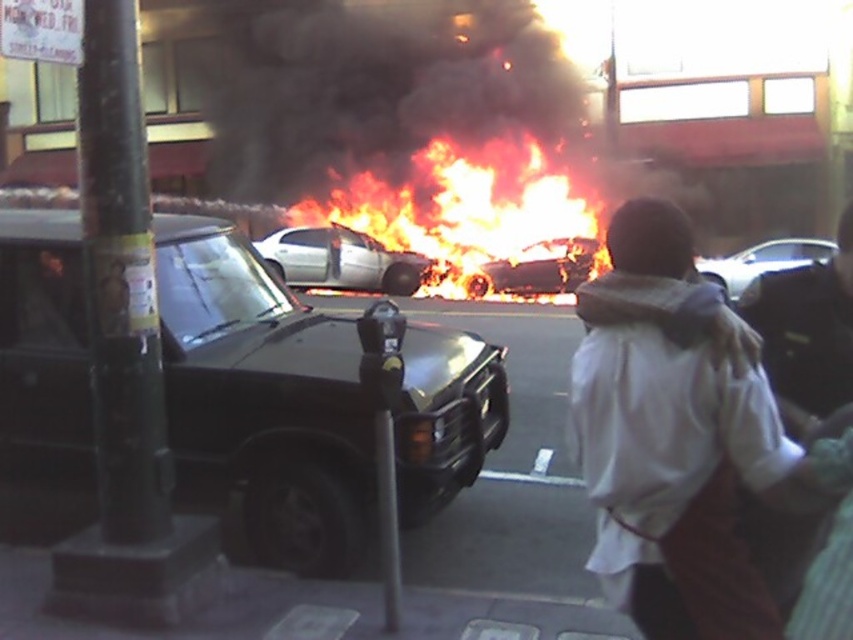
You are a firefighter arriving at the scene. You see the flaming car at center and the shiny silver sedan at right. Which vehicle is higher up in the image?

The flaming car at center is above the shiny silver sedan at right, so it is higher up in the image.

You are a firefighter standing at the edge of the scene. You need to reach the flaming car at center to extinguish the flames. Given that your fire hose can spray water up to 25 meters, will you be able to reach the flames from your current position?

The flaming car at center is 24.87 meters away from the viewer. Since the fire hose can spray up to 25 meters, you can reach the flames from your current position as the distance is within the hose range.

You are a pedestrian trying to cross the street safely. There is a metallic gray parking meter at center and a shiny silver sedan at right. Which object is closer to the left side of the street?

The metallic gray parking meter at center is closer to the left side of the street because it is positioned to the left of the shiny silver sedan at right.